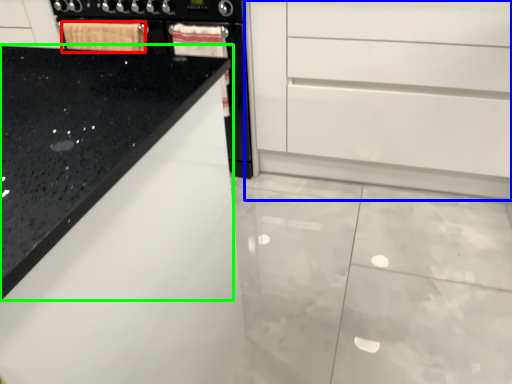
Question: Which is nearer to the material (highlighted by a red box)? chest of drawers (highlighted by a blue box) or countertop (highlighted by a green box).

Choices:
 (A) chest of drawers
 (B) countertop

Answer: (A)